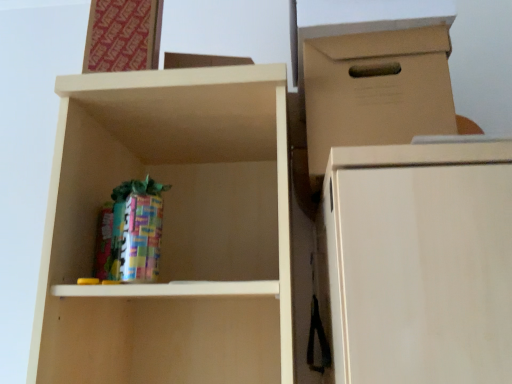
What is the approximate width of cardboard box at upper right?

cardboard box at upper right is 14.59 inches in width.

Describe the element at coordinates (373, 72) in the screenshot. I see `cardboard box at upper right` at that location.

Find the location of `cardboard box at upper right`. cardboard box at upper right is located at coordinates (373, 72).

You are a GUI agent. You are given a task and a screenshot of the screen. Output one action in this format:
    pyautogui.click(x=<x>, y=<y>)
    Task: Click on the cardboard box at upper right
    The width and height of the screenshot is (512, 384).
    Given the screenshot: What is the action you would take?
    pyautogui.click(x=373, y=72)